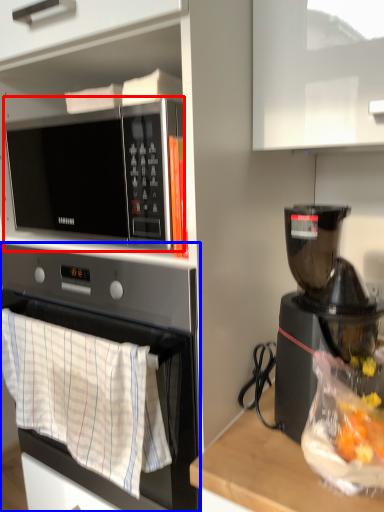
Question: Which object appears farthest to the camera in this image, microwave oven (highlighted by a red box) or oven (highlighted by a blue box)?

Choices:
 (A) microwave oven
 (B) oven

Answer: (A)